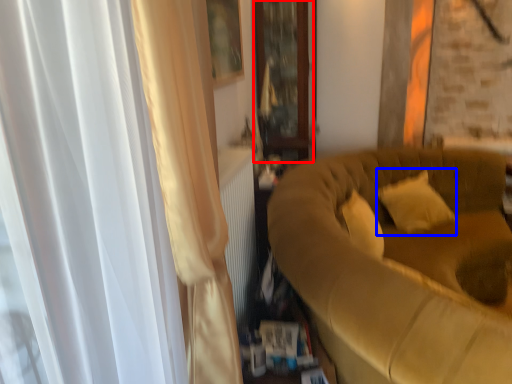
Question: Among these objects, which one is nearest to the camera, glass door (highlighted by a red box) or pillow (highlighted by a blue box)?

Choices:
 (A) glass door
 (B) pillow

Answer: (B)